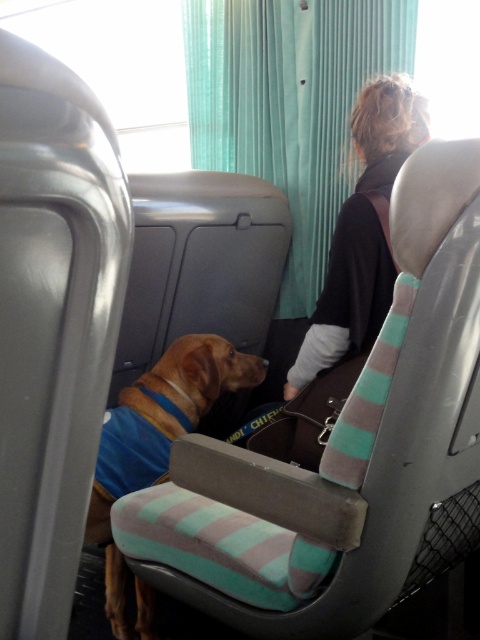
Question: Does teal fabric curtain at upper center lie in front of dark brown hair at upper right?

Choices:
 (A) no
 (B) yes

Answer: (A)

Question: Which is nearer to the brown matte dog at center?

Choices:
 (A) dark brown hair at upper right
 (B) teal fabric curtain at upper center
 (C) striped fabric lap at center

Answer: (C)

Question: Among these points, which one is nearest to the camera?

Choices:
 (A) (101, 524)
 (B) (319, 413)

Answer: (B)

Question: Can you confirm if dark brown hair at upper right is positioned to the right of brown matte dog at center?

Choices:
 (A) yes
 (B) no

Answer: (A)

Question: Does brown matte dog at center lie behind striped fabric lap at center?

Choices:
 (A) yes
 (B) no

Answer: (A)

Question: Which of the following is the closest to the observer?

Choices:
 (A) striped fabric lap at center
 (B) teal fabric curtain at upper center
 (C) dark brown hair at upper right
 (D) brown matte dog at center

Answer: (A)